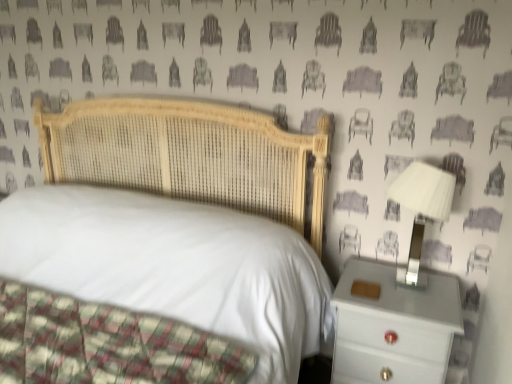
Question: In terms of height, does woven wood bed at center look taller or shorter compared to white plastic lampshade at right?

Choices:
 (A) tall
 (B) short

Answer: (A)

Question: From the image's perspective, is woven wood bed at center above or below white plastic lampshade at right?

Choices:
 (A) above
 (B) below

Answer: (B)

Question: Which of these objects is positioned farthest from the white plastic lampshade at right?

Choices:
 (A) woven wood bed at center
 (B) white glossy nightstand at right

Answer: (A)

Question: Estimate the real-world distances between objects in this image. Which object is closer to the woven wood bed at center?

Choices:
 (A) white glossy nightstand at right
 (B) white plastic lampshade at right

Answer: (A)